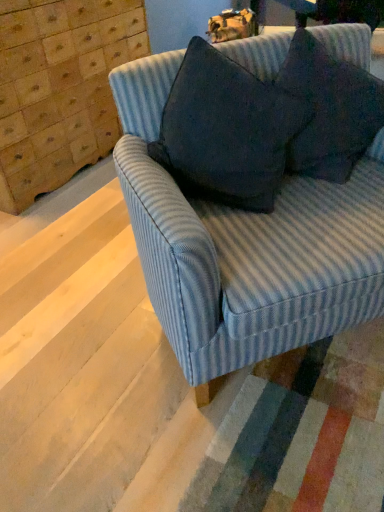
Find the location of a particular element. This screenshot has width=384, height=512. space that is in front of wooden dresser at upper left is located at coordinates (66, 233).